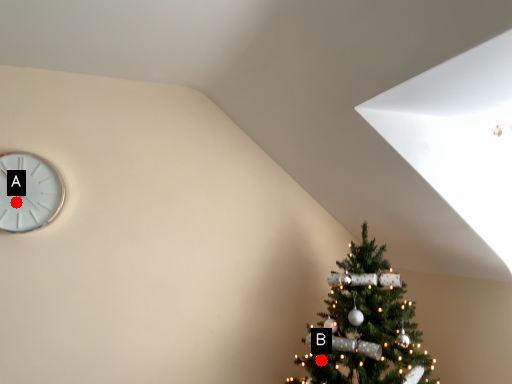
Question: Two points are circled on the image, labeled by A and B beside each circle. Which point appears farthest from the camera in this image?

Choices:
 (A) A is further
 (B) B is further

Answer: (A)